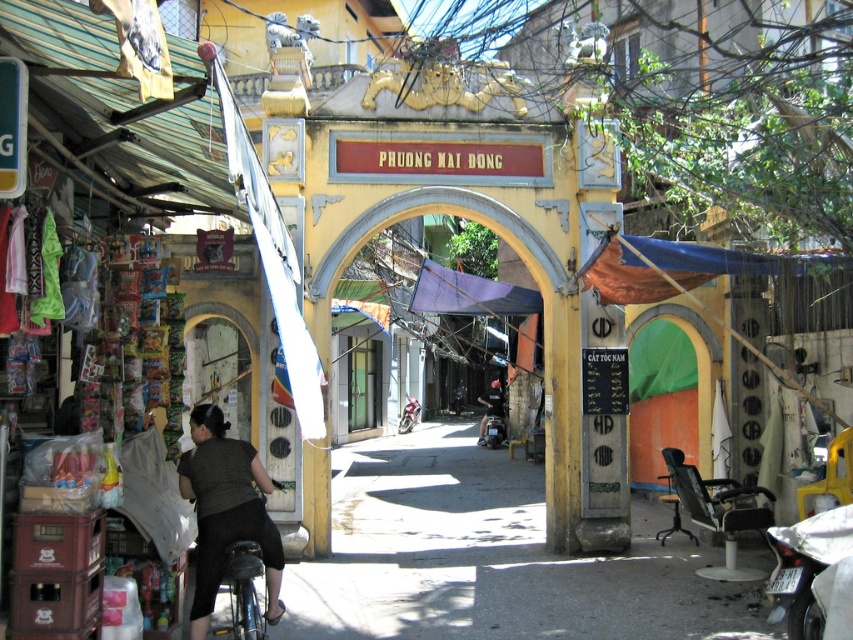
You are standing at the point marked as point (225,512) in the image. What object is located at that point?

The knitted sweater at lower left is located at point (225,512).

You are a traveler who wants to buy a knitted sweater at lower left and a shiny silver motorcycle at center. However, you have a small backpack with limited space. Which item should you prioritize packing first based on their sizes?

The knitted sweater at lower left has a larger size compared to the shiny silver motorcycle at center, so you should prioritize packing the knitted sweater at lower left first since it takes up more space.

You are a tourist standing in front of the PHUONG MAI DONG market archway. You see a dark gray fabric jacket at center and a shiny silver motorcycle at center. Which object is taller?

The dark gray fabric jacket at center is much taller than the shiny silver motorcycle at center.